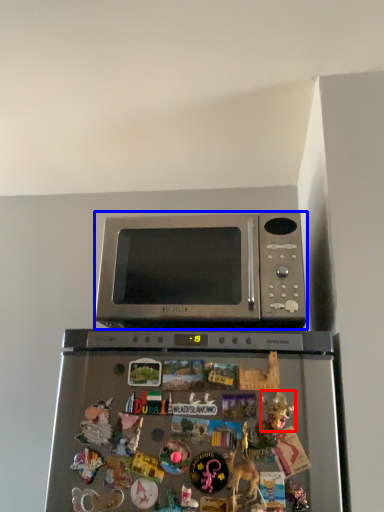
Question: Which object appears farthest to the camera in this image, toy (highlighted by a red box) or microwave oven (highlighted by a blue box)?

Choices:
 (A) toy
 (B) microwave oven

Answer: (B)